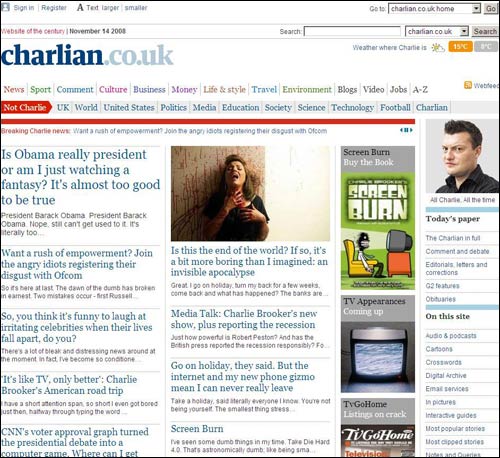
Locate an element on the screen. The height and width of the screenshot is (458, 500). tv is located at coordinates (355, 364), (381, 354).